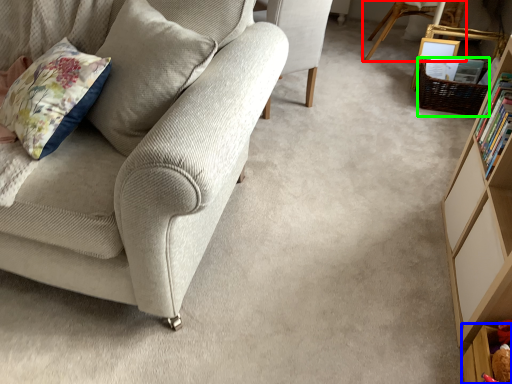
Question: Based on their relative distances, which object is farther from chair (highlighted by a red box)? Choose from shelf (highlighted by a blue box) and basket (highlighted by a green box).

Choices:
 (A) shelf
 (B) basket

Answer: (A)